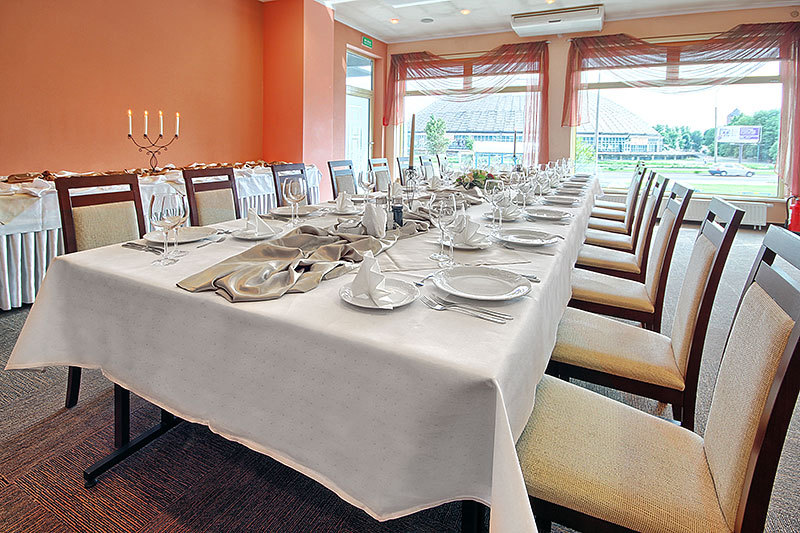
Locate an element on the screen. utensils is located at coordinates (488, 316), (542, 249), (564, 216), (146, 242), (226, 228), (281, 217), (326, 204), (138, 473).